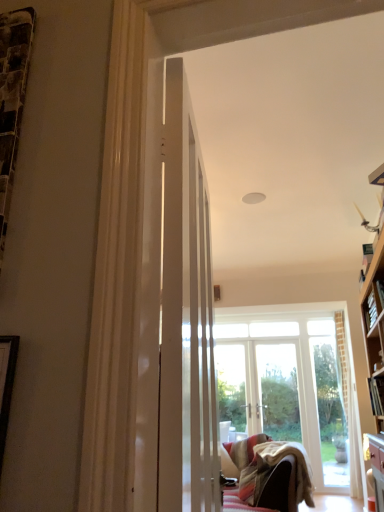
Question: Is point (372, 409) positioned closer to the camera than point (264, 452)?

Choices:
 (A) closer
 (B) farther

Answer: (A)

Question: In terms of height, does hardcover book at right, placed as the 1th book when sorted from bottom to top, look taller or shorter compared to velvet beige couch at lower center?

Choices:
 (A) tall
 (B) short

Answer: (B)

Question: Based on their relative distances, which object is farther from the white glossy door at center?

Choices:
 (A) hardcover book at right, which is counted as the first book, starting from the front
 (B) wooden bookshelf at right, positioned as the 1th book in top-to-bottom order
 (C) velvet beige couch at lower center

Answer: (C)

Question: Which of these objects is positioned farthest from the velvet beige couch at lower center?

Choices:
 (A) hardcover book at right, which is counted as the first book, starting from the front
 (B) wooden bookshelf at right, which is the 2th book in bottom-to-top order
 (C) white glossy door at center

Answer: (C)